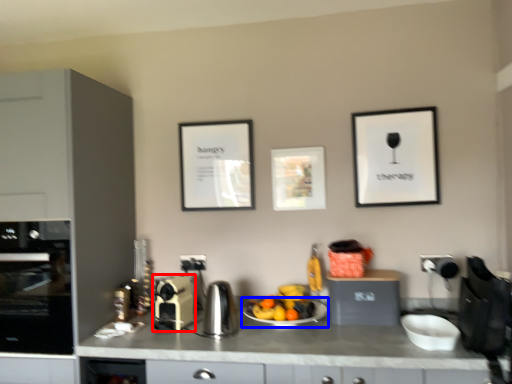
Question: Which object appears closest to the camera in this image, kitchen appliance (highlighted by a red box) or plate (highlighted by a blue box)?

Choices:
 (A) kitchen appliance
 (B) plate

Answer: (B)